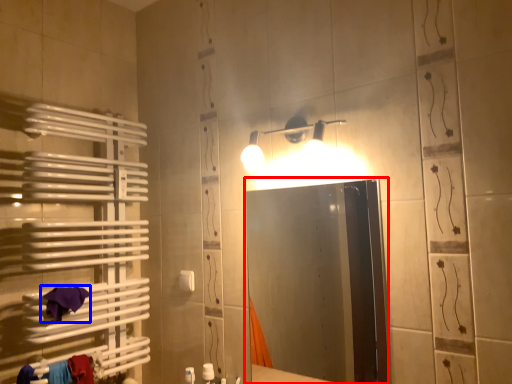
Question: Which object is closer to the camera taking this photo, mirror (highlighted by a red box) or bath towel (highlighted by a blue box)?

Choices:
 (A) mirror
 (B) bath towel

Answer: (A)